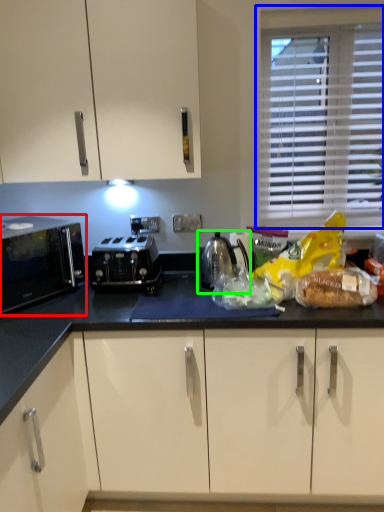
Question: Which is farther away from home appliance (highlighted by a red box)? window (highlighted by a blue box) or kitchen appliance (highlighted by a green box)?

Choices:
 (A) window
 (B) kitchen appliance

Answer: (A)